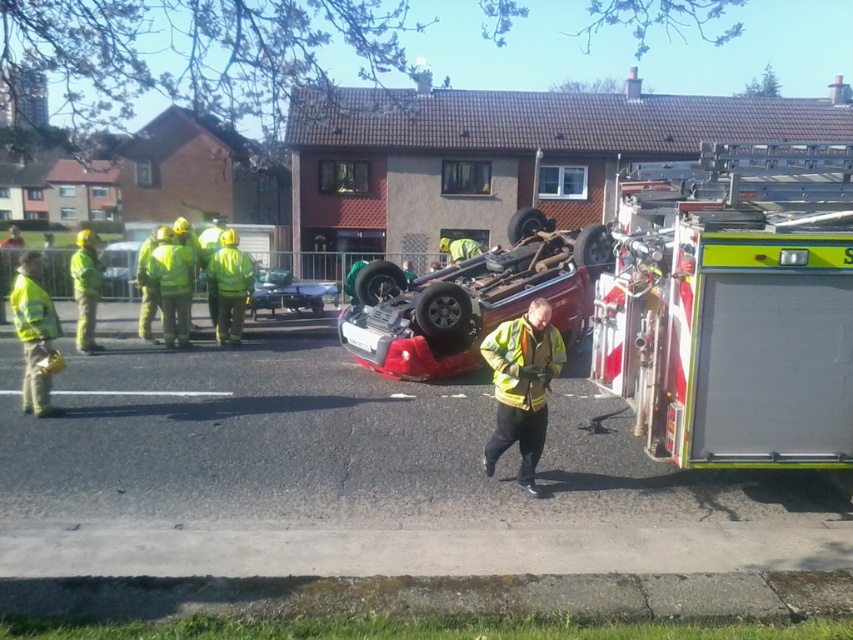
Question: Which point is farther to the camera?

Choices:
 (A) high visibility yellow jacket at left
 (B) high-visibility reflective jacket at left
 (C) metallic silver car at center

Answer: (C)

Question: From the image, what is the correct spatial relationship of white metallic fire truck at right in relation to yellow reflective jacket at center?

Choices:
 (A) below
 (B) above

Answer: (B)

Question: Considering the relative positions of high visibility yellow jacket at left and metallic green car at center in the image provided, where is high visibility yellow jacket at left located with respect to metallic green car at center?

Choices:
 (A) right
 (B) left

Answer: (B)

Question: Does high visibility reflective jacket at center come behind metallic green car at center?

Choices:
 (A) yes
 (B) no

Answer: (B)

Question: Considering the real-world distances, which object is farthest from the high-visibility reflective jacket at left?

Choices:
 (A) metallic green car at center
 (B) metallic red car at center
 (C) yellow reflective jacket at center

Answer: (C)

Question: Among these objects, which one is nearest to the camera?

Choices:
 (A) high visibility yellow jacket at left
 (B) metallic red car at center
 (C) high-visibility reflective jacket at center
 (D) high-visibility reflective jacket at left

Answer: (A)